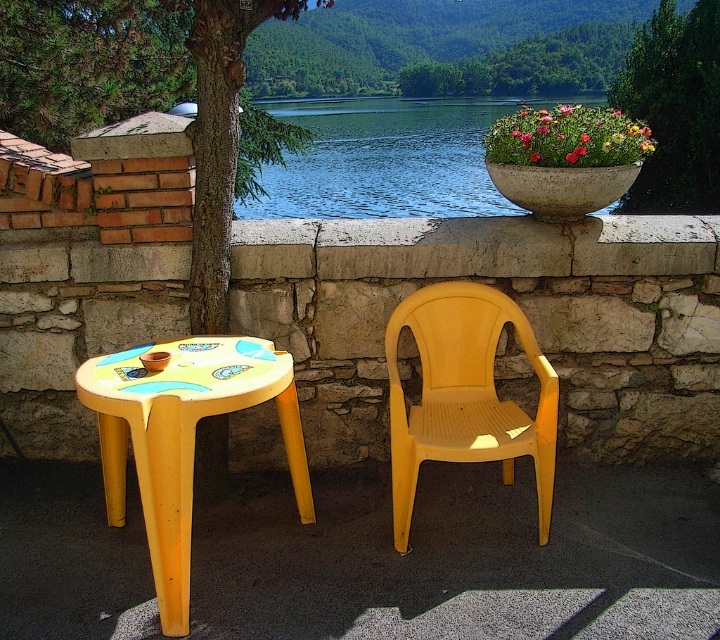
You are standing at the point marked as point (464, 394) in the image. What object is directly in front of you?

The point (464, 394) corresponds to the yellow plastic chair at center, so the yellow plastic chair at center is directly in front of you.

You are standing on the patio and want to place a new bench between the green rough bark tree at upper left and the yellow plastic chair at center. Considering their widths, which object should you position closer to the center of the patio to ensure the bench fits properly?

The green rough bark tree at upper left is wider than the yellow plastic chair at center. To ensure the bench fits, position the wider tree closer to the edge and the narrower chair closer to the center, allowing more space between them for the bench.